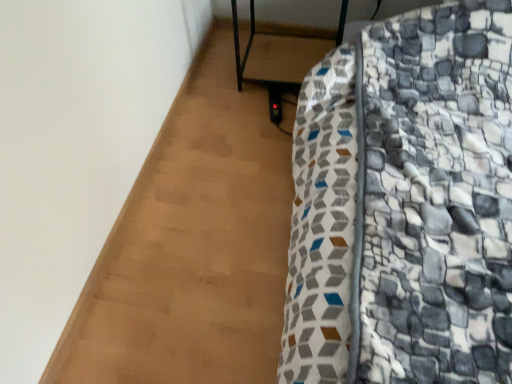
Find the location of a particular element. Image resolution: width=512 pixels, height=384 pixels. free space in front of metallic black side table at center, the second furniture positioned from the bottom is located at coordinates (253, 126).